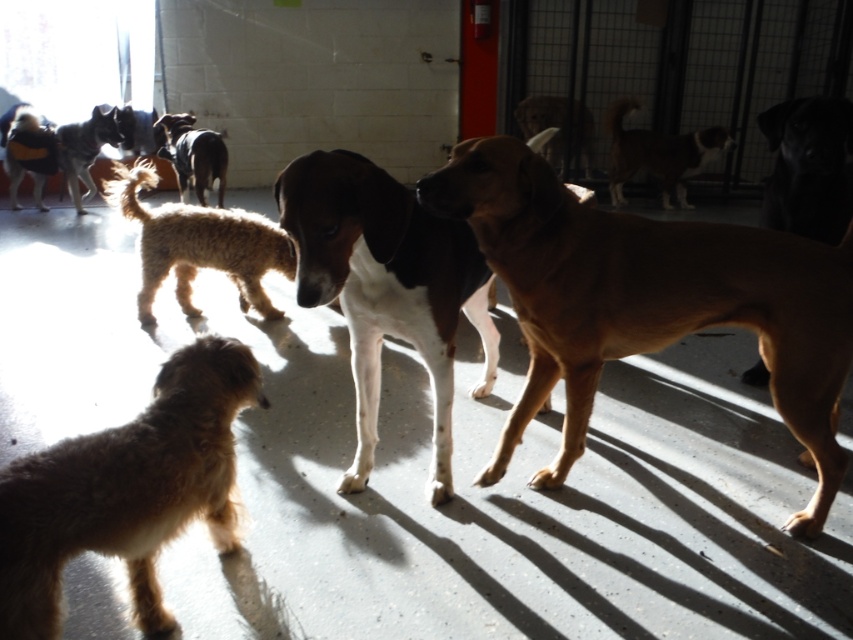
Question: Which of the following is the farthest from the observer?

Choices:
 (A) (198, 310)
 (B) (689, 208)

Answer: (B)

Question: Among these objects, which one is nearest to the camera?

Choices:
 (A) white and brown fur at center
 (B) brown fur dog at center

Answer: (A)

Question: Is brown smooth dog at center wider than short-haired brown dog at center?

Choices:
 (A) yes
 (B) no

Answer: (A)

Question: Does brown smooth dog at center appear over short-haired brown dog at center?

Choices:
 (A) yes
 (B) no

Answer: (B)

Question: Does fuzzy brown dog at lower left come in front of white and brown fur at center?

Choices:
 (A) no
 (B) yes

Answer: (B)

Question: Estimate the real-world distances between objects in this image. Which object is closer to the short-haired brown dog at center?

Choices:
 (A) fuzzy brown dog at lower left
 (B) black smooth dog at upper right
 (C) brown smooth dog at center

Answer: (A)